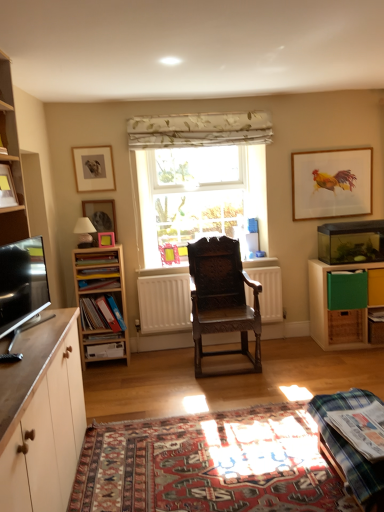
This screenshot has width=384, height=512. I want to click on vacant space to the left of dark wood carved chair at center, so click(171, 366).